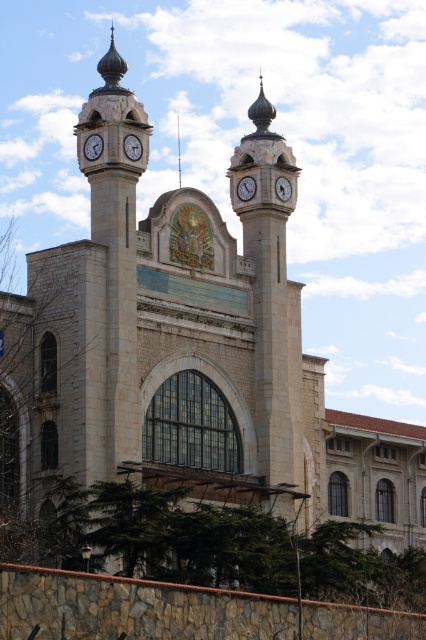
Does matte white clock at left have a larger size compared to smooth silver spire at center?

Actually, matte white clock at left might be smaller than smooth silver spire at center.

Between point (101, 147) and point (180, 173), which one is positioned behind?

The point (180, 173) is behind.

Identify the location of matte white clock at left. This screenshot has height=640, width=426. pos(92,147).

Does white glossy clock at upper center appear under smooth silver spire at center?

Indeed, white glossy clock at upper center is positioned under smooth silver spire at center.

Between white glossy clock at upper center and smooth silver spire at center, which one is positioned lower?

→ white glossy clock at upper center is below.

Measure the distance between white glossy clock at upper center and camera.

288.80 feet

Locate an element on the screen. white glossy clock at upper center is located at coordinates (245, 188).

Is the position of matte white clock at left more distant than that of matte white clock at upper center?

No, matte white clock at left is in front of matte white clock at upper center.

Locate an element on the screen. This screenshot has height=640, width=426. matte white clock at left is located at coordinates (92, 147).

Is point (91, 134) positioned behind point (287, 198)?

No, it is not.

The width and height of the screenshot is (426, 640). What are the coordinates of `matte white clock at left` in the screenshot? It's located at (92, 147).